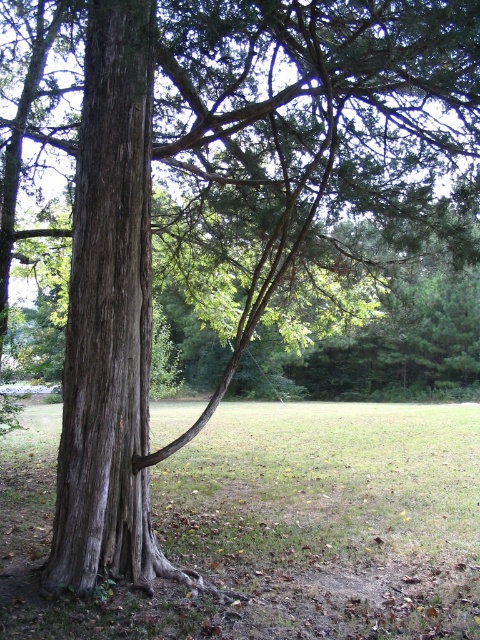
Consider the image. Can you confirm if green grass at lower center is bigger than grayish-brown bark tree trunk at left?

Yes.

Which of these two, green grass at lower center or grayish-brown bark tree trunk at left, stands shorter?

green grass at lower center is shorter.

Is point (276, 476) closer to viewer compared to point (61, 435)?

No, (276, 476) is further to viewer.

I want to click on green grass at lower center, so click(275, 525).